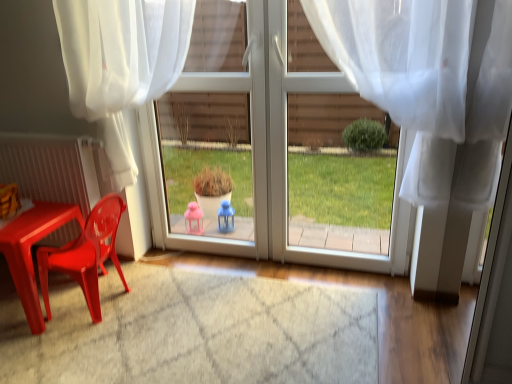
Image resolution: width=512 pixels, height=384 pixels. Identify the location of vacant space situated above matte plastic radiator at left (from a real-world perspective). (35, 134).